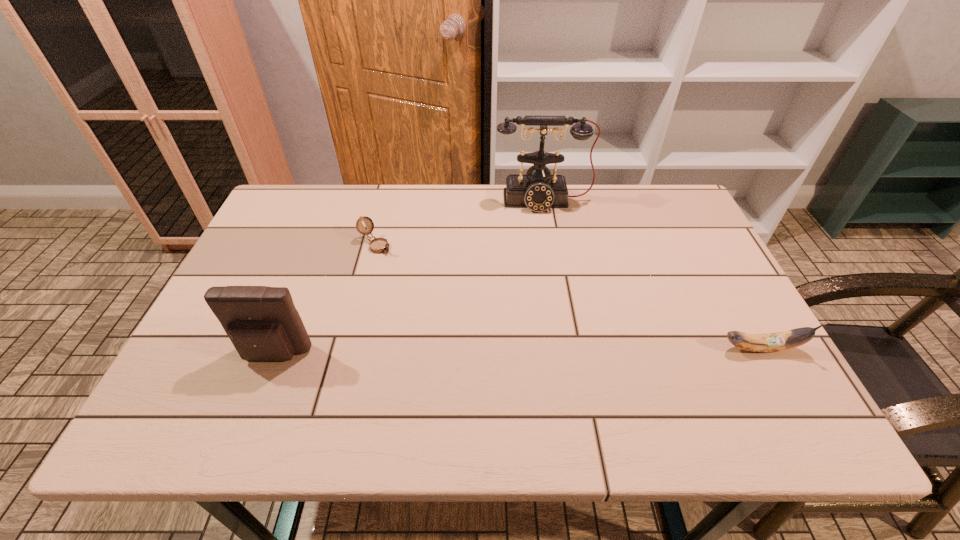
Where is `free spot on the desktop that is between the third shortest object and the rightmost object and is positioned on the dial of the second object from right to left`? free spot on the desktop that is between the third shortest object and the rightmost object and is positioned on the dial of the second object from right to left is located at coordinates (565, 351).

Find the location of a particular element. free space on the desktop that is between the pouch and the banana and is positioned on the face of the compass is located at coordinates (510, 352).